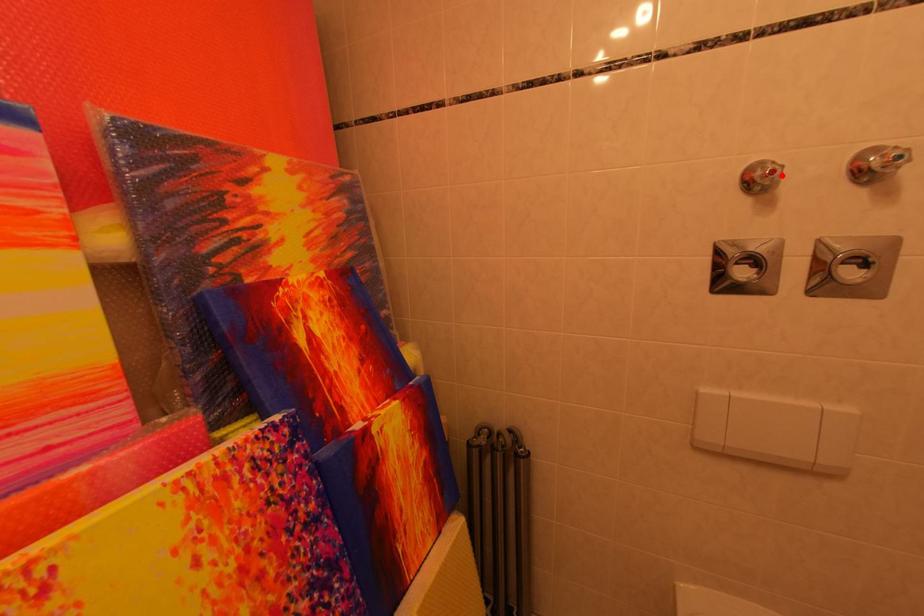
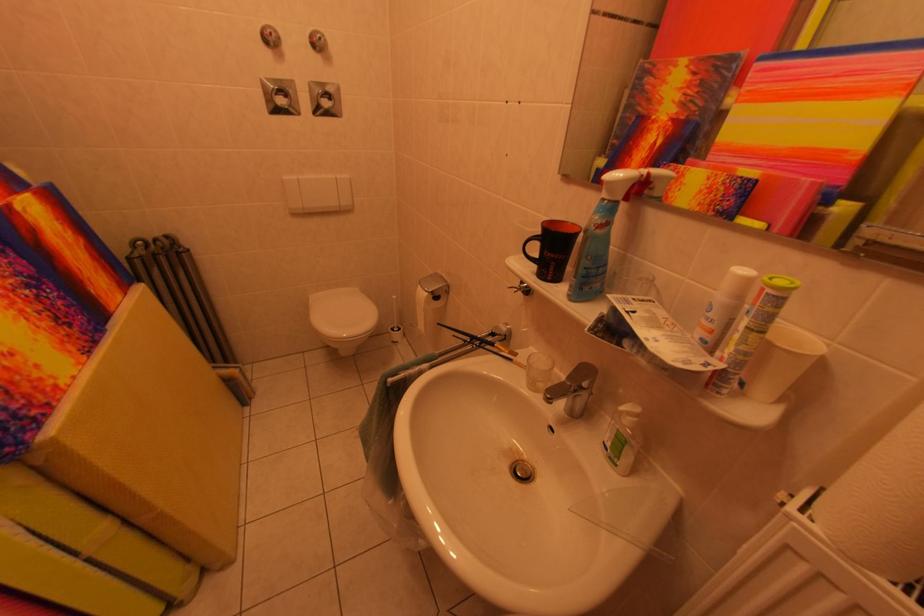
Locate, in the second image, the point that corresponds to the highlighted location in the first image.

(278, 39)